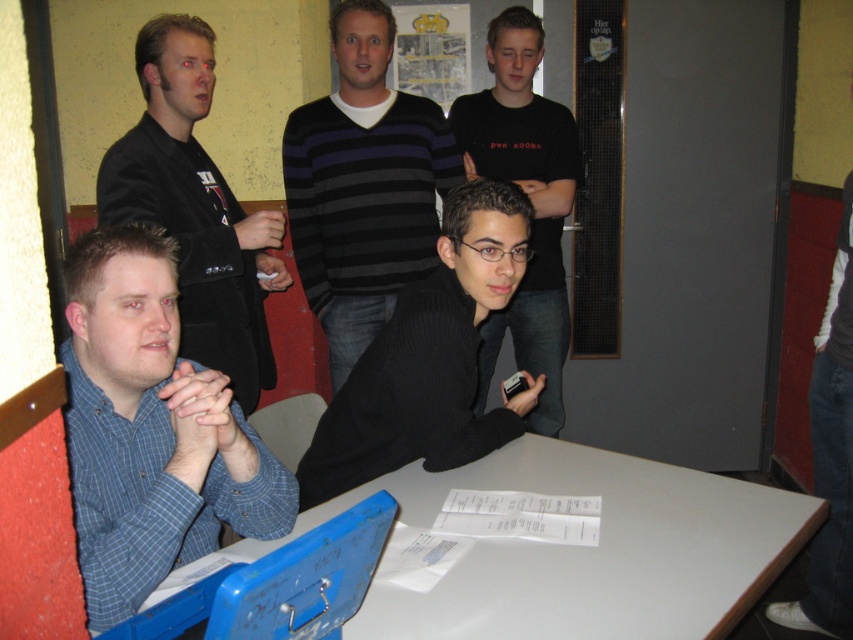
You are standing in the room and want to hand a drink to the person wearing the blue checkered shirt at left. Based on their position, where should you approach from to ensure you are facing them directly?

The blue checkered shirt at left is located at point (151, 429), so you should approach from the front to face them directly.

You are a photographer setting up a shoot in this indoor scene. You need to position a light source so that it illuminates the striped sweater at center without affecting the black ribbed sweater at center. Based on their positions, is this possible?

Yes, the striped sweater at center is above the black ribbed sweater at center, so positioning the light source above the striped sweater at center would illuminate it while keeping the light from reaching the lower black ribbed sweater at center.

You are a photographer setting up a shoot in this scene. You need to place a 1.2 meter wide backdrop behind the white glossy table at lower center and the black matte shirt at center. Based on their widths, will the backdrop be wide enough to cover both objects?

The white glossy table at lower center might be wider than black matte shirt at center, so the 1.2 meter backdrop may or may not be sufficient depending on the actual width of the table. Further measurement is needed to confirm.